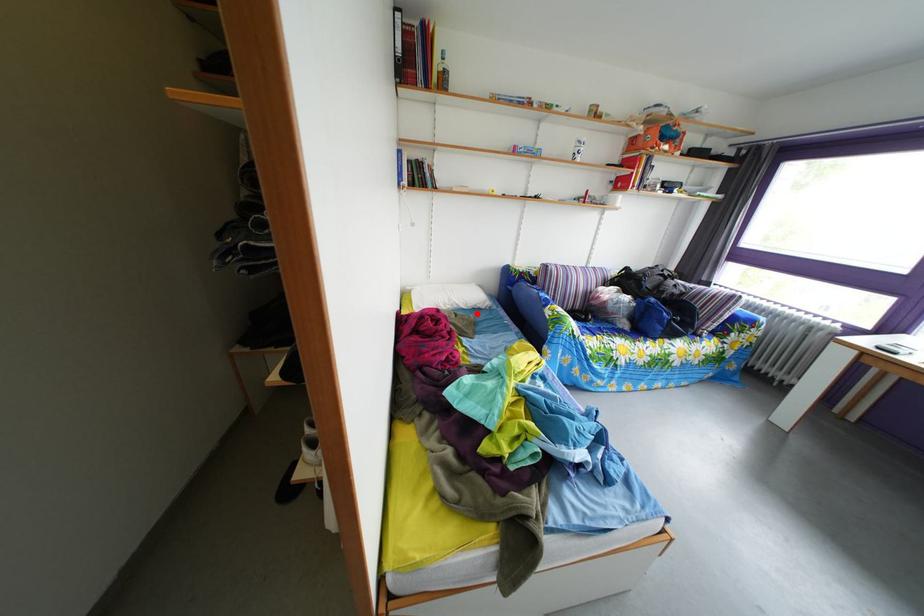
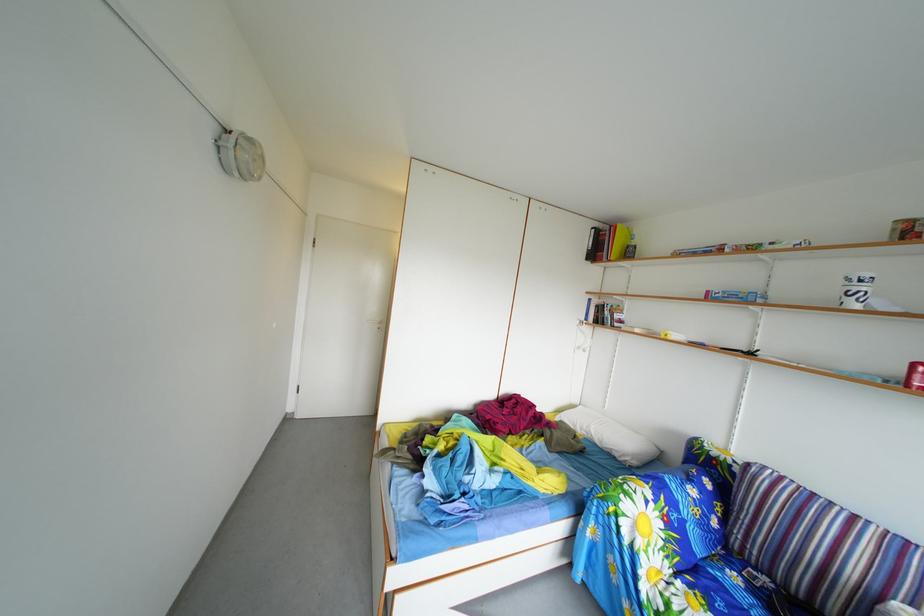
Where in the second image is the point corresponding to the highlighted location from the first image?

(612, 451)